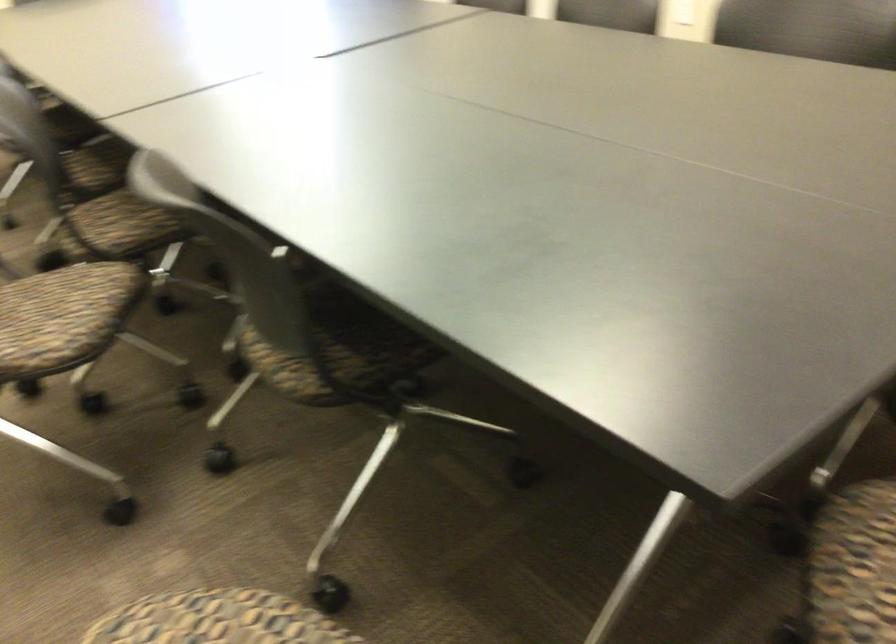
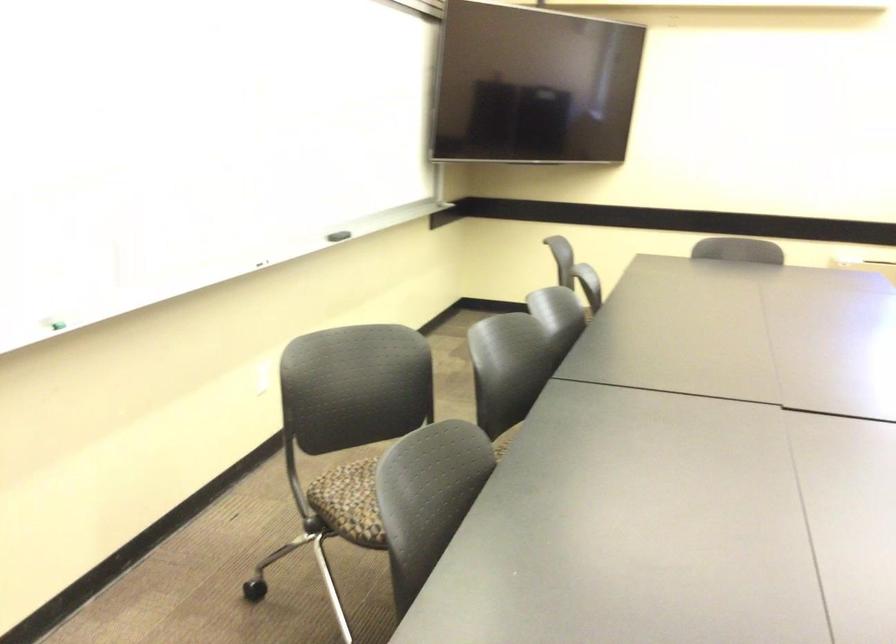
Question: I am providing you with two images of the same scene from different viewpoints. Please identify which objects are invisible in image2.

Choices:
 (A) yellow bath sponge
 (B) patterned chair sitting surface
 (C) black whiteboard eraser
 (D) green whiteboard marker

Answer: (B)